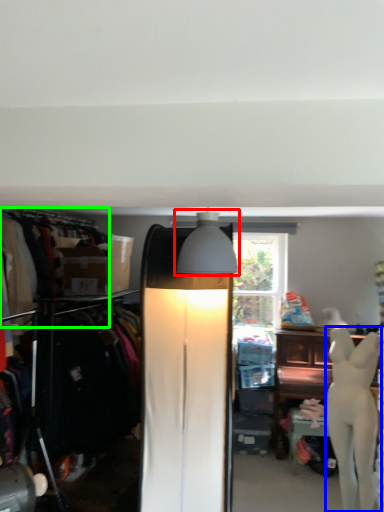
Question: Which is farther away from lamp (highlighted by a red box)? mannequin (highlighted by a blue box) or clothing (highlighted by a green box)?

Choices:
 (A) mannequin
 (B) clothing

Answer: (A)